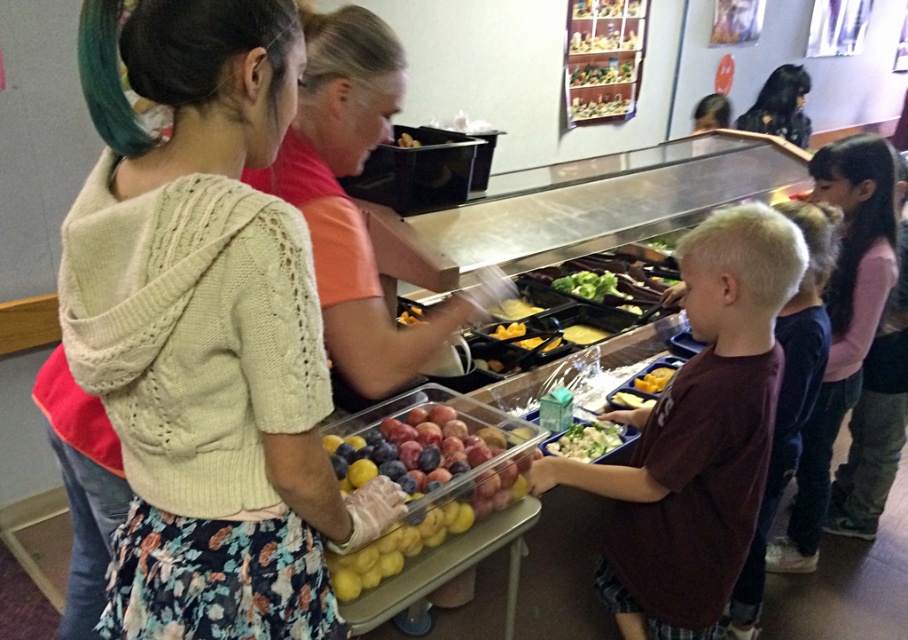
Is matte orange shirt at center closer to the viewer compared to pink fabric shirt at upper right?

That is True.

Locate an element on the screen. This screenshot has height=640, width=908. matte orange shirt at center is located at coordinates (352, 202).

Who is shorter, pink fabric shirt at upper right or yellow matte cheese at center?

Standing shorter between the two is yellow matte cheese at center.

Is pink fabric shirt at upper right thinner than yellow matte cheese at center?

No, pink fabric shirt at upper right is not thinner than yellow matte cheese at center.

Describe the element at coordinates (842, 323) in the screenshot. Image resolution: width=908 pixels, height=640 pixels. I see `pink fabric shirt at upper right` at that location.

Where is `pink fabric shirt at upper right`? This screenshot has height=640, width=908. pink fabric shirt at upper right is located at coordinates (842, 323).

Can you confirm if pink fabric shirt at upper right is smaller than maroon cotton shirt at center?

Actually, pink fabric shirt at upper right might be larger than maroon cotton shirt at center.

Which is above, pink fabric shirt at upper right or maroon cotton shirt at center?

pink fabric shirt at upper right is higher up.

At what (x,y) coordinates should I click in order to perform the action: click on pink fabric shirt at upper right. Please return your answer as a coordinate pair (x, y). Looking at the image, I should click on (842, 323).

Locate an element on the screen. pink fabric shirt at upper right is located at coordinates (842, 323).